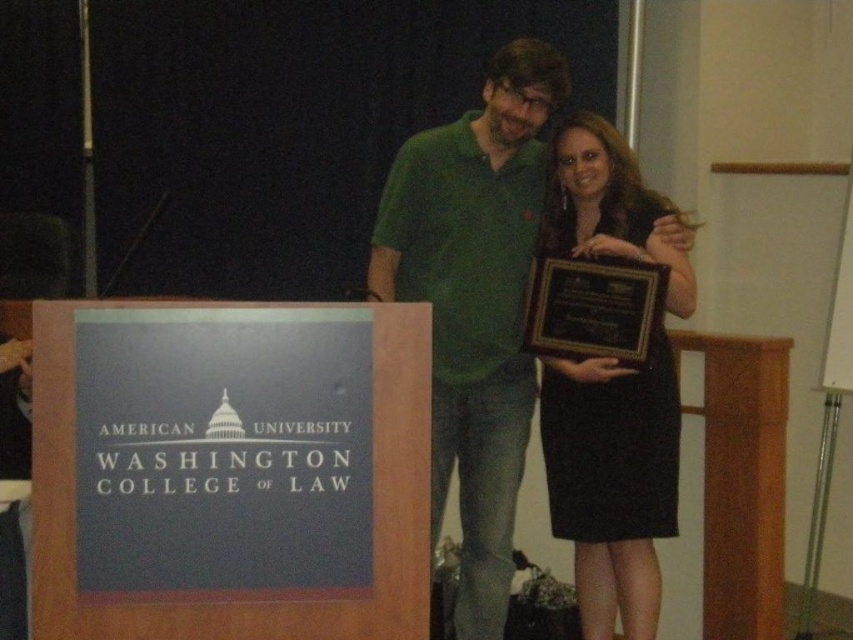
You are attending the American University Washington College of Law event and need to locate the blue cardboard sign at left. According to the coordinates provided, where would you find it in the image?

The blue cardboard sign at left is located at the coordinates point (230,472) in the image.

You are a photographer at the event and want to capture a closeup shot of the black satin dress at center. Given that your camera has a minimum focusing distance of 2 meters, will you be able to take the photo without moving closer?

The black satin dress at center is 2.68 meters from the camera, which is beyond the camera minimum focusing distance of 2 meters. Therefore, you can take the photo without moving closer.

You are standing at the center of the image and want to locate the blue cardboard sign at left. In which direction should you look to find it?

The blue cardboard sign at left is located at point (230, 472) in 2D coordinates, so you should look to your left to find it.